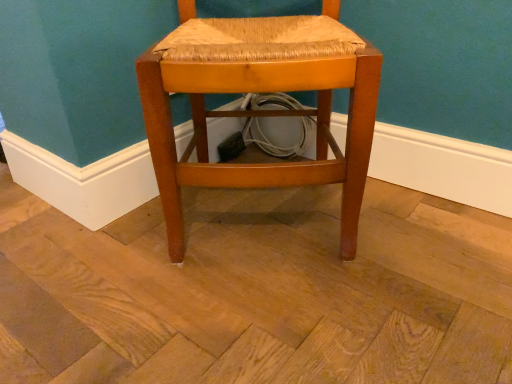
You are a GUI agent. You are given a task and a screenshot of the screen. Output one action in this format:
    pyautogui.click(x=<x>, y=<y>)
    Task: Click on the vacant space in front of matte wood chair at center
    The image size is (512, 384).
    Given the screenshot: What is the action you would take?
    pyautogui.click(x=270, y=313)